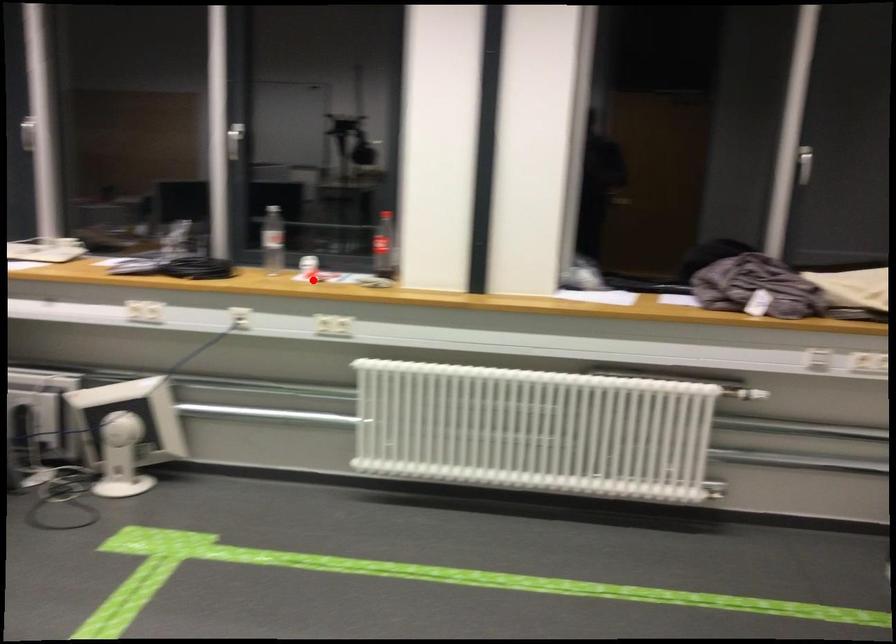
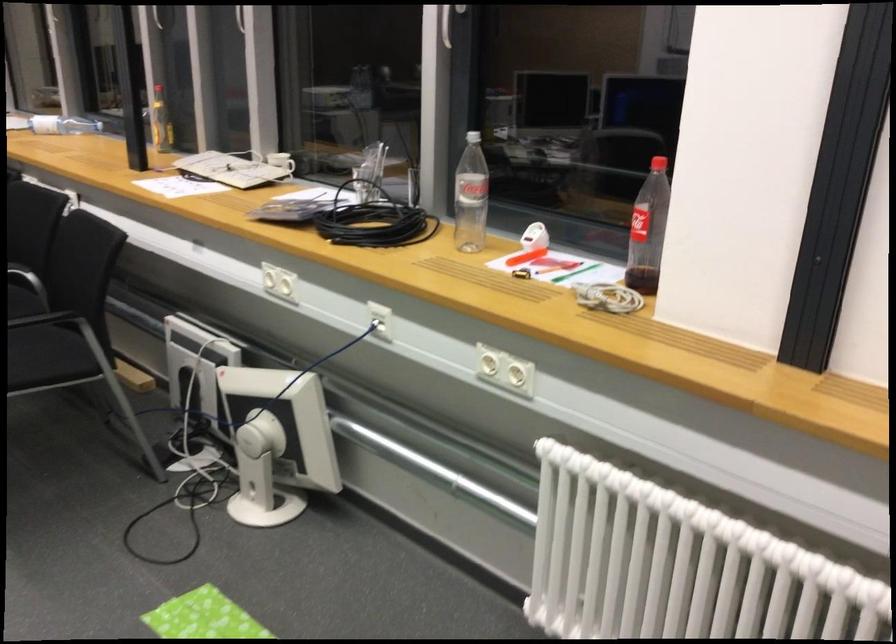
The point at the highlighted location is marked in the first image. Where is the corresponding point in the second image?

(524, 256)